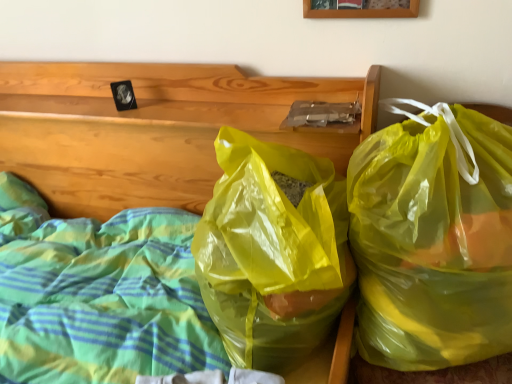
Question: From the image's perspective, is yellow translucent bag at right under wooden picture frame at upper center?

Choices:
 (A) yes
 (B) no

Answer: (A)

Question: Is yellow translucent bag at right closer to the viewer compared to wooden picture frame at upper center?

Choices:
 (A) no
 (B) yes

Answer: (B)

Question: Is yellow translucent bag at right further to camera compared to wooden picture frame at upper center?

Choices:
 (A) yes
 (B) no

Answer: (B)

Question: Considering the relative sizes of yellow translucent bag at right and wooden picture frame at upper center in the image provided, is yellow translucent bag at right taller than wooden picture frame at upper center?

Choices:
 (A) no
 (B) yes

Answer: (B)

Question: From the image's perspective, is yellow translucent bag at right on top of wooden picture frame at upper center?

Choices:
 (A) yes
 (B) no

Answer: (B)

Question: Considering the relative sizes of yellow translucent bag at right and wooden picture frame at upper center in the image provided, is yellow translucent bag at right smaller than wooden picture frame at upper center?

Choices:
 (A) yes
 (B) no

Answer: (B)

Question: Can you confirm if translucent plastic bags at center is taller than wooden picture frame at upper center?

Choices:
 (A) yes
 (B) no

Answer: (A)

Question: Is translucent plastic bags at center to the left of wooden picture frame at upper center from the viewer's perspective?

Choices:
 (A) yes
 (B) no

Answer: (A)

Question: From the image's perspective, is translucent plastic bags at center under wooden picture frame at upper center?

Choices:
 (A) no
 (B) yes

Answer: (B)

Question: From a real-world perspective, is translucent plastic bags at center physically above wooden picture frame at upper center?

Choices:
 (A) no
 (B) yes

Answer: (A)

Question: Is translucent plastic bags at center positioned before wooden picture frame at upper center?

Choices:
 (A) yes
 (B) no

Answer: (A)

Question: Is translucent plastic bags at center outside wooden picture frame at upper center?

Choices:
 (A) yes
 (B) no

Answer: (A)

Question: Is yellow translucent bag at right thinner than translucent plastic bags at center?

Choices:
 (A) no
 (B) yes

Answer: (B)